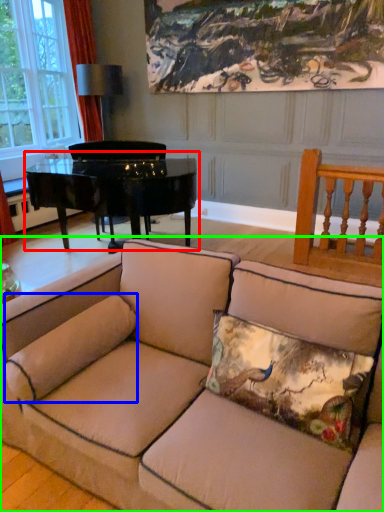
Question: Which is nearer to the table (highlighted by a red box)? pillow (highlighted by a blue box) or studio couch (highlighted by a green box).

Choices:
 (A) pillow
 (B) studio couch

Answer: (B)